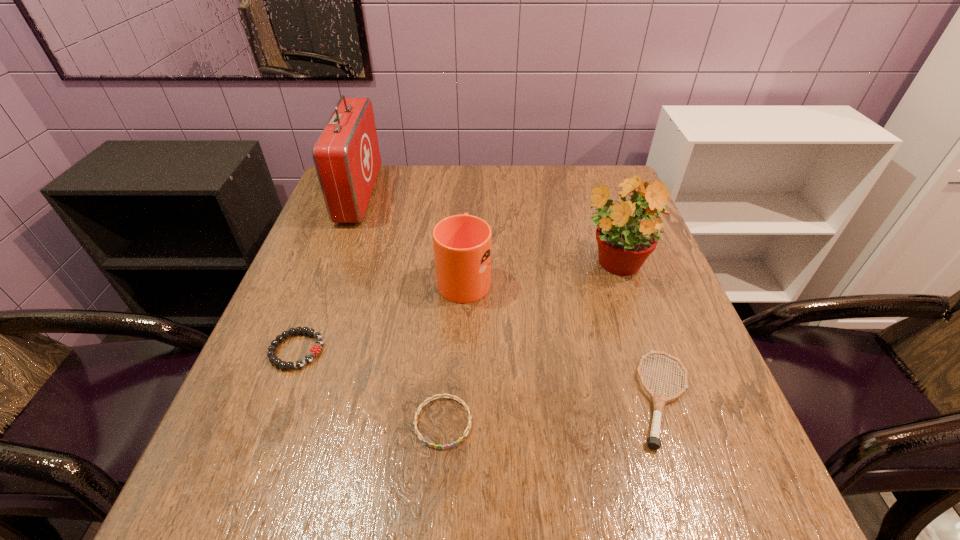
In order to click on the first-aid kit in this screenshot , I will do `click(346, 155)`.

Locate an element on the screen. The image size is (960, 540). flowerpot is located at coordinates (624, 243).

The image size is (960, 540). I want to click on the third tallest object, so click(x=462, y=244).

At what (x,y) coordinates should I click in order to perform the action: click on tennis racket. Please return your answer as a coordinate pair (x, y). The height and width of the screenshot is (540, 960). Looking at the image, I should click on (659, 400).

The height and width of the screenshot is (540, 960). I want to click on the second shortest object, so click(315, 350).

Find the location of a particular element. This screenshot has width=960, height=540. the farther bracelet is located at coordinates (315, 350).

Image resolution: width=960 pixels, height=540 pixels. I want to click on the right bracelet, so click(x=459, y=400).

Find the location of a particular element. the shortest object is located at coordinates (459, 400).

At what (x,y) coordinates should I click in order to perform the action: click on free location located on the side of the first-aid kit with the first aid cross symbol. Please return your answer as a coordinate pair (x, y). The image size is (960, 540). Looking at the image, I should click on (397, 195).

The width and height of the screenshot is (960, 540). Identify the location of vacant space positioned on the front of the flowerpot. tap(639, 345).